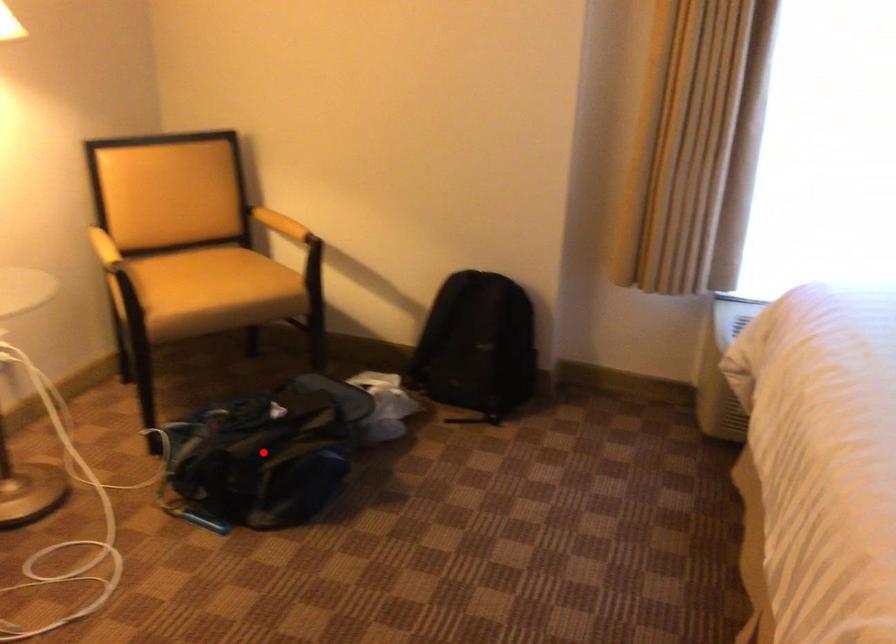
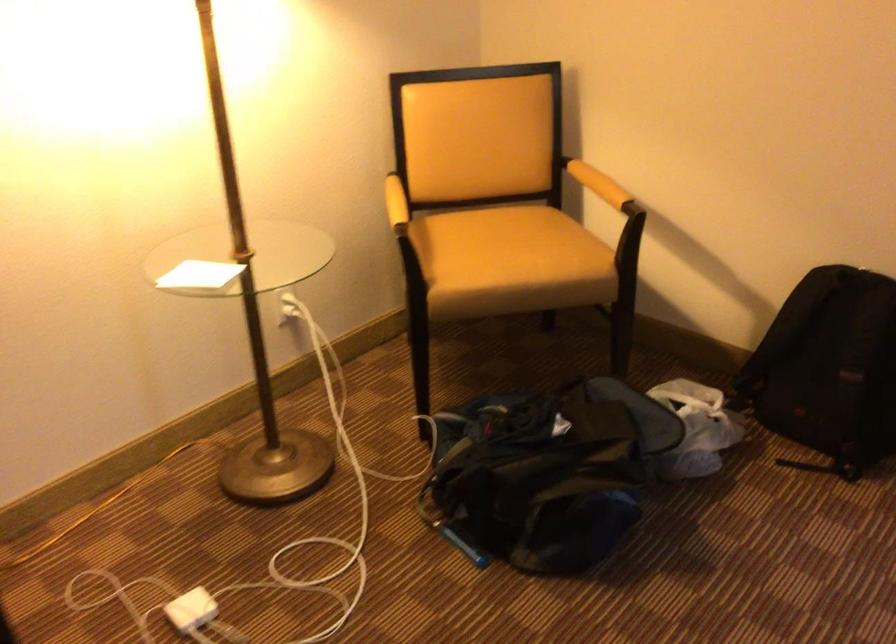
Question: I am providing you with two images of the same scene from different viewpoints. In image1, a red point is highlighted. Considering the same 3D point in image2, which of the following is correct?

Choices:
 (A) It is closer
 (B) It is farther

Answer: (A)